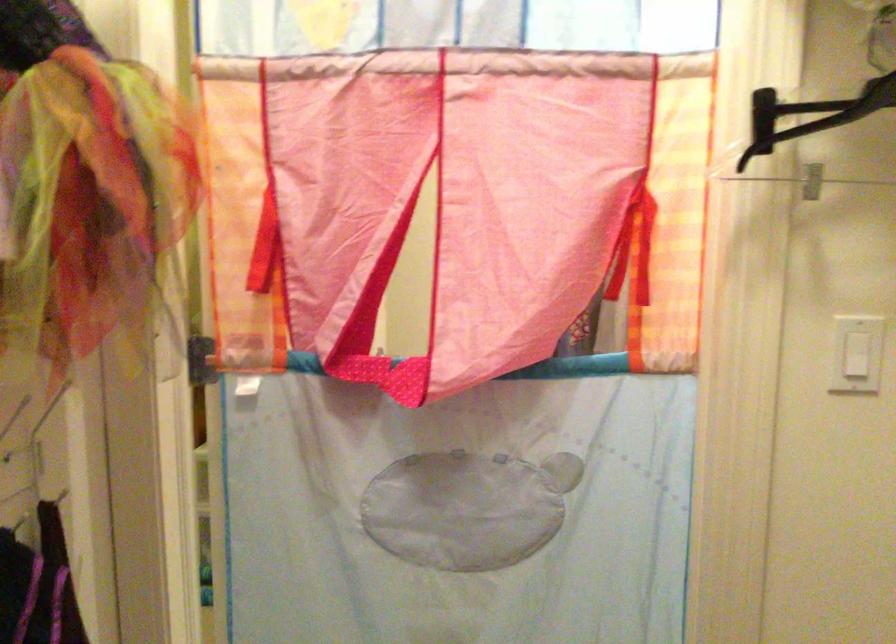
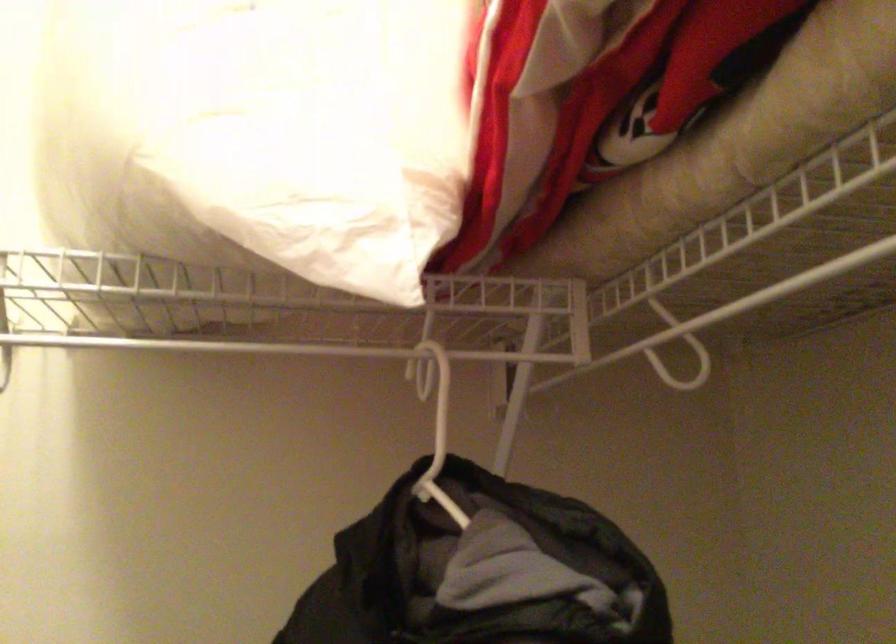
Question: The images are taken continuously from a first-person perspective. In which direction is your viewpoint rotating?

Choices:
 (A) Left
 (B) Right
 (C) Up
 (D) Down

Answer: (B)